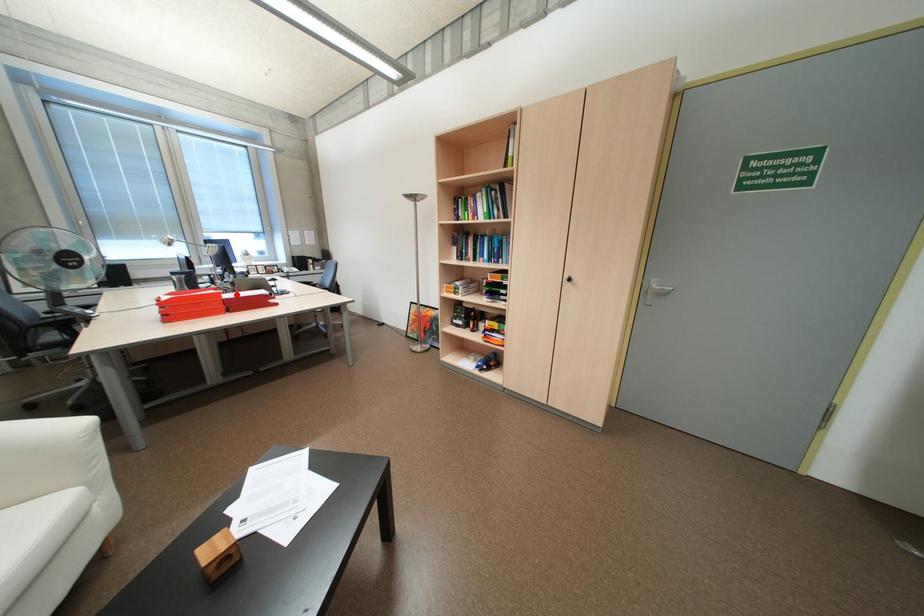
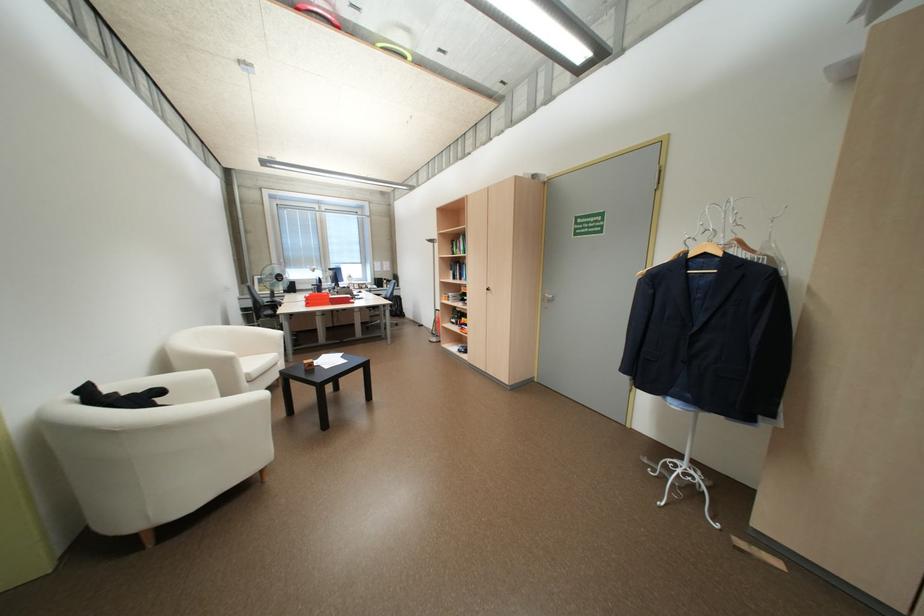
In the second image, find the point that corresponds to the highlighted location in the first image.

(342, 296)